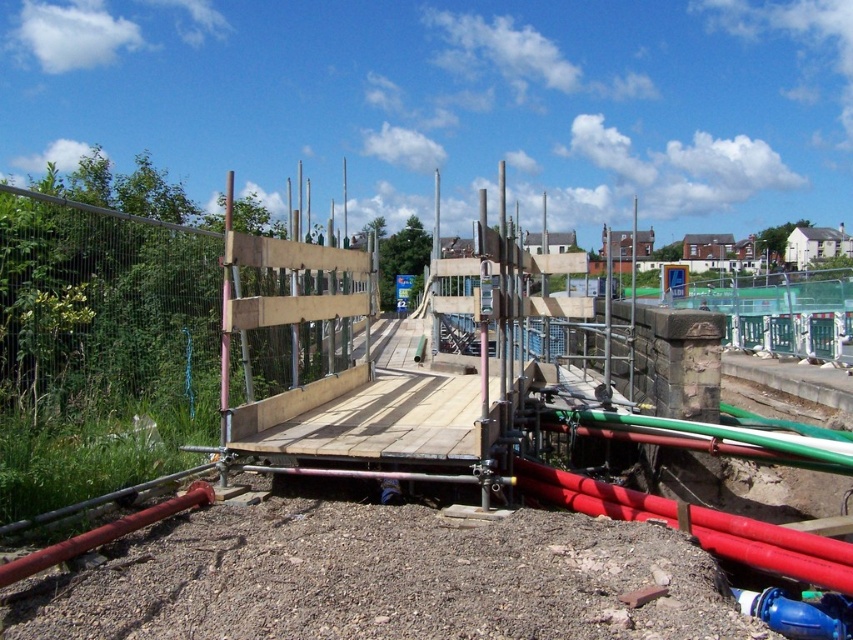
You are a construction worker who needs to move a heavy tool from the wooden platform at center to the blue rubber hose at lower right. Which direction should you move the tool to reach the hose?

The wooden platform at center is to the left of the blue rubber hose at lower right, so you should move the tool to the right to reach the hose.

You are a construction worker needing to move a tool from the wooden platform at center to the blue rubber hose at lower right. The tool requires a path that is at least 9 feet wide. Can you safely move the tool along the path between them?

The distance between the wooden platform at center and blue rubber hose at lower right is 9.21 feet, which is wider than the required 9 feet. Therefore, the tool can be safely moved along the path between them.